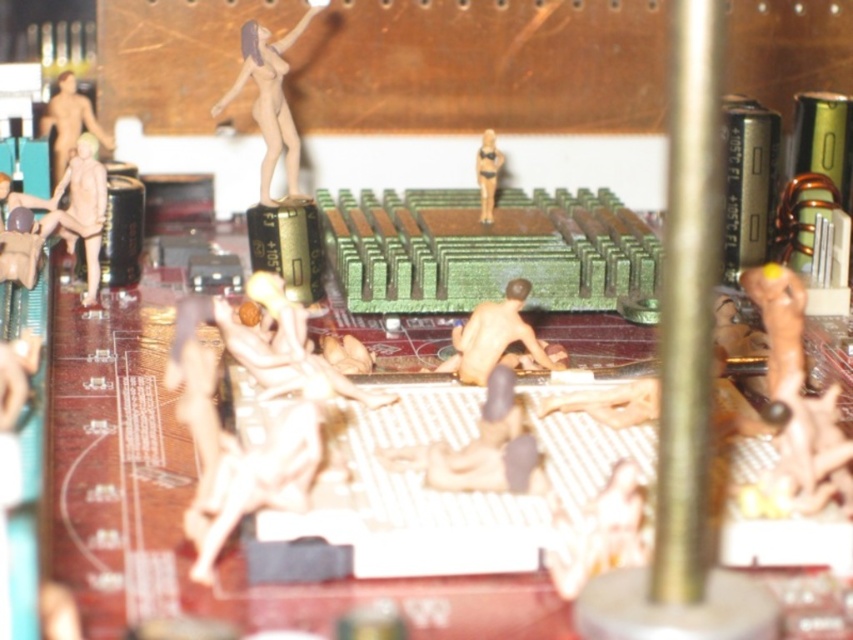
Which is more to the left, matte plastic person at upper left or matte yellow bikini at center?

From the viewer's perspective, matte plastic person at upper left appears more on the left side.

Consider the image. Is matte plastic person at upper left to the left of matte yellow bikini at center from the viewer's perspective?

A: Correct, you'll find matte plastic person at upper left to the left of matte yellow bikini at center.

Is point (99, 140) positioned after point (492, 134)?

Yes, point (99, 140) is behind point (492, 134).

Where is `matte plastic person at upper left`? matte plastic person at upper left is located at coordinates (68, 122).

Is nude figure at center to the left of matte beige figure at left from the viewer's perspective?

Incorrect, nude figure at center is not on the left side of matte beige figure at left.

Can you confirm if nude figure at center is positioned below matte beige figure at left?

Yes, nude figure at center is below matte beige figure at left.

Does point (498, 353) lie in front of point (82, 140)?

Yes, point (498, 353) is closer to viewer.

I want to click on nude figure at center, so click(498, 339).

Does point (276, 106) come in front of point (79, 170)?

No.

Is point (292, 150) farther from camera compared to point (90, 211)?

Yes.

Locate an element on the screen. This screenshot has height=640, width=853. matte plastic nude figure at upper center is located at coordinates (270, 100).